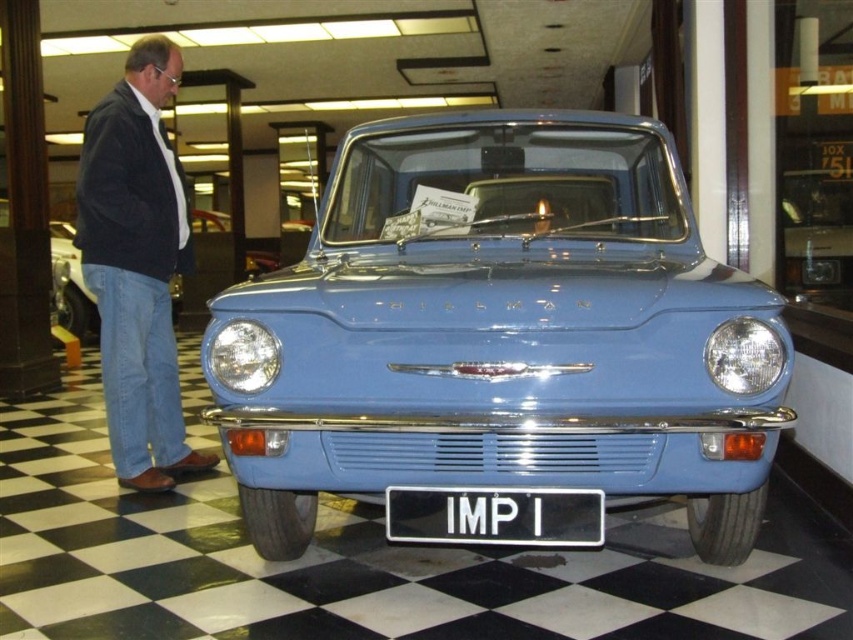
Can you confirm if denim jeans at left is positioned below black plastic license plate at center?

No, denim jeans at left is not below black plastic license plate at center.

Between denim jeans at left and black plastic license plate at center, which one is positioned lower?

black plastic license plate at center is lower down.

I want to click on denim jeans at left, so click(x=137, y=264).

Locate an element on the screen. This screenshot has height=640, width=853. denim jeans at left is located at coordinates (137, 264).

Is black plastic license plate at center taller than matte blue car at left?

No, black plastic license plate at center is not taller than matte blue car at left.

Which is behind, point (509, 500) or point (97, 326)?

Positioned behind is point (97, 326).

Is point (456, 529) in front of point (194, 288)?

Yes, it is.

This screenshot has height=640, width=853. Identify the location of black plastic license plate at center. (495, 516).

Can you confirm if light blue glossy car at center is wider than matte blue car at left?

Yes.

Does light blue glossy car at center have a smaller size compared to matte blue car at left?

No.

Between point (372, 336) and point (198, 301), which one is positioned in front?

Point (372, 336) is in front.

Where is `light blue glossy car at center`? This screenshot has width=853, height=640. light blue glossy car at center is located at coordinates (502, 332).